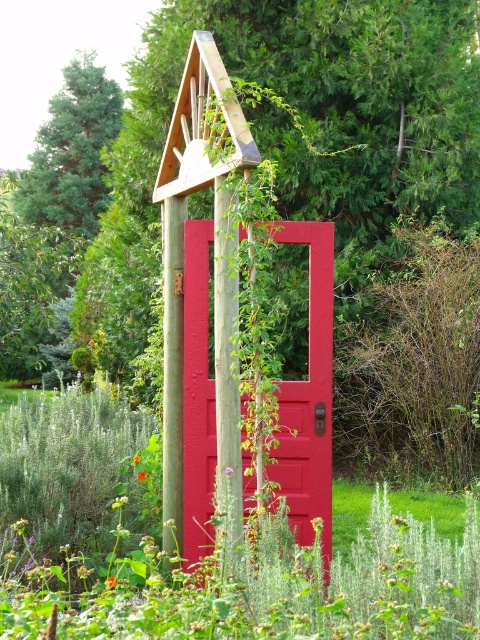
How far apart are matte wooden door at center and wooden post at center?

The distance of matte wooden door at center from wooden post at center is 24.16 inches.

Is point (299, 413) behind point (180, 250)?

No, it is not.

What do you see at coordinates (309, 397) in the screenshot? I see `matte wooden door at center` at bounding box center [309, 397].

Where is `matte wooden door at center`? matte wooden door at center is located at coordinates (309, 397).